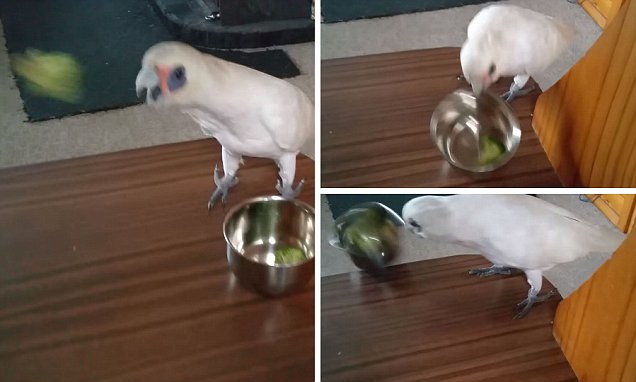
Where is `carpet`? The width and height of the screenshot is (636, 382). carpet is located at coordinates (120, 130).